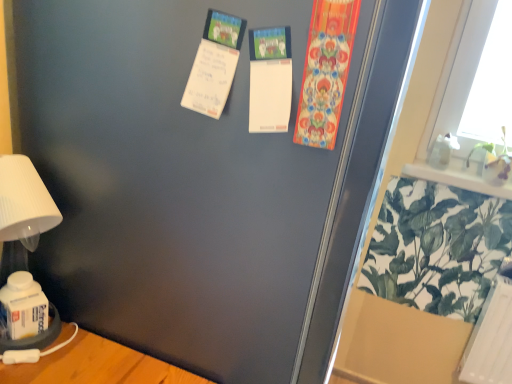
Question: Considering the relative positions of green leafy plant at lower right, the first plant when ordered from bottom to top, and transparent plastic screen door at upper right in the image provided, is green leafy plant at lower right, the first plant when ordered from bottom to top, in front of transparent plastic screen door at upper right?

Choices:
 (A) no
 (B) yes

Answer: (A)

Question: Is green leafy plant at lower right, the first plant when ordered from bottom to top, beside transparent plastic screen door at upper right?

Choices:
 (A) yes
 (B) no

Answer: (B)

Question: Is green leafy plant at lower right, the first plant when ordered from bottom to top, positioned far away from transparent plastic screen door at upper right?

Choices:
 (A) no
 (B) yes

Answer: (B)

Question: Is green leafy plant at lower right, the first plant when ordered from bottom to top, at the left side of transparent plastic screen door at upper right?

Choices:
 (A) yes
 (B) no

Answer: (B)

Question: From the image's perspective, would you say green leafy plant at lower right, the first plant when ordered from bottom to top, is shown under transparent plastic screen door at upper right?

Choices:
 (A) no
 (B) yes

Answer: (B)

Question: Considering their positions, is white paper postcard at upper center, which is the first postcard from left to right, located in front of or behind white matte table lamp at lower left?

Choices:
 (A) front
 (B) behind

Answer: (A)

Question: Would you say white paper postcard at upper center, which is the first postcard from left to right, is inside or outside white matte table lamp at lower left?

Choices:
 (A) inside
 (B) outside

Answer: (B)

Question: From the image's perspective, is white paper postcard at upper center, which is the first postcard from left to right, above or below white matte table lamp at lower left?

Choices:
 (A) below
 (B) above

Answer: (B)

Question: From a real-world perspective, is white paper postcard at upper center, placed as the second postcard when sorted from right to left, positioned above or below white matte table lamp at lower left?

Choices:
 (A) above
 (B) below

Answer: (A)

Question: Looking at their shapes, would you say green leafy plant at lower right, the second plant when ordered from top to bottom, is wider or thinner than green leafy plant at upper right, which ranks as the 1th plant in top-to-bottom order?

Choices:
 (A) thin
 (B) wide

Answer: (A)

Question: Is green leafy plant at lower right, the first plant when ordered from bottom to top, situated inside green leafy plant at upper right, which ranks as the 1th plant in top-to-bottom order, or outside?

Choices:
 (A) inside
 (B) outside

Answer: (B)

Question: Considering the positions of green leafy plant at lower right, the second plant when ordered from top to bottom, and green leafy plant at upper right, which appears as the 2th plant when ordered from the bottom, in the image, is green leafy plant at lower right, the second plant when ordered from top to bottom, bigger or smaller than green leafy plant at upper right, which appears as the 2th plant when ordered from the bottom,?

Choices:
 (A) small
 (B) big

Answer: (B)

Question: From a real-world perspective, is green leafy plant at lower right, the first plant when ordered from bottom to top, above or below green leafy plant at upper right, which appears as the 2th plant when ordered from the bottom?

Choices:
 (A) below
 (B) above

Answer: (A)

Question: In the image, is green leafy plant at lower right, the first plant when ordered from bottom to top, on the left side or the right side of white matte table lamp at lower left?

Choices:
 (A) right
 (B) left

Answer: (A)

Question: Is green leafy plant at lower right, the second plant when ordered from top to bottom, situated inside white matte table lamp at lower left or outside?

Choices:
 (A) outside
 (B) inside

Answer: (A)